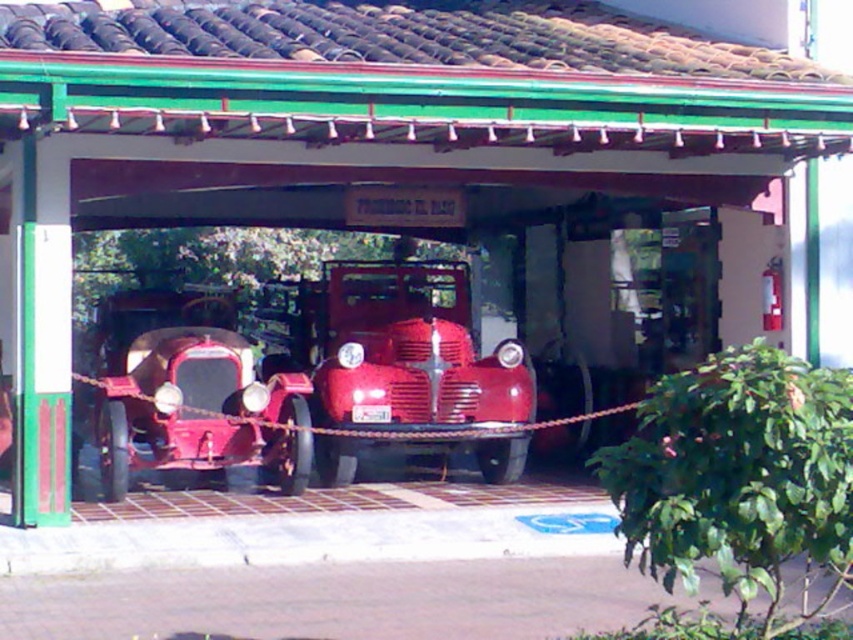
Question: Is glossy red truck at center smaller than shiny red car at center?

Choices:
 (A) yes
 (B) no

Answer: (B)

Question: Which point is farther to the camera?

Choices:
 (A) (329, 333)
 (B) (171, 380)

Answer: (A)

Question: Where is glossy red truck at center located in relation to shiny red car at center in the image?

Choices:
 (A) right
 (B) left

Answer: (A)

Question: Is glossy red truck at center bigger than shiny red car at center?

Choices:
 (A) no
 (B) yes

Answer: (B)

Question: Which point is closer to the camera?

Choices:
 (A) (405, 333)
 (B) (149, 388)

Answer: (B)